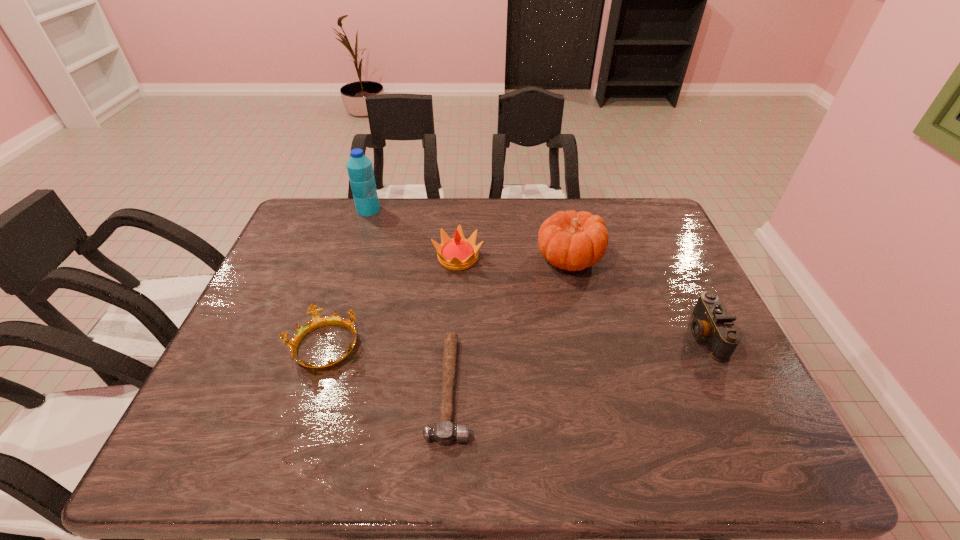
This screenshot has height=540, width=960. I want to click on free space between the pumpkin and the nearer crown, so click(446, 303).

The image size is (960, 540). I want to click on vacant area between the rightmost object and the fifth tallest object, so click(515, 341).

Where is `free space between the shortest object and the tallest object`? Image resolution: width=960 pixels, height=540 pixels. free space between the shortest object and the tallest object is located at coordinates (409, 299).

You are a GUI agent. You are given a task and a screenshot of the screen. Output one action in this format:
    pyautogui.click(x=<x>, y=<y>)
    Task: Click on the empty location between the fifth shortest object and the second shortest object
    Image resolution: width=960 pixels, height=540 pixels.
    Given the screenshot: What is the action you would take?
    pyautogui.click(x=446, y=303)

Locate an element on the screen. empty location between the third shortest object and the farthest object is located at coordinates (537, 272).

Locate an element on the screen. The width and height of the screenshot is (960, 540). vacant region between the camera and the shorter crown is located at coordinates (515, 341).

Locate an element on the screen. This screenshot has width=960, height=540. vacant space in between the fifth object from left to right and the camera is located at coordinates (636, 296).

The height and width of the screenshot is (540, 960). I want to click on free space between the fifth shortest object and the fourth tallest object, so click(636, 296).

The height and width of the screenshot is (540, 960). I want to click on free space between the shorter crown and the rightmost object, so click(x=515, y=341).

Find the location of a particular element. Image resolution: width=960 pixels, height=540 pixels. vacant area that lies between the rightmost object and the third tallest object is located at coordinates (581, 296).